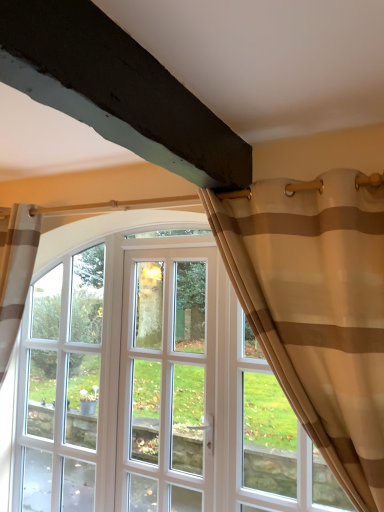
Question: Is the depth of clear glass window at center less than that of beige sheer curtain at upper right?

Choices:
 (A) no
 (B) yes

Answer: (A)

Question: Is clear glass window at center aimed at beige sheer curtain at upper right?

Choices:
 (A) yes
 (B) no

Answer: (B)

Question: From the image's perspective, is clear glass window at center on top of beige sheer curtain at upper right?

Choices:
 (A) no
 (B) yes

Answer: (A)

Question: Considering the relative sizes of clear glass window at center and beige sheer curtain at upper right in the image provided, is clear glass window at center wider than beige sheer curtain at upper right?

Choices:
 (A) no
 (B) yes

Answer: (A)

Question: Are clear glass window at center and beige sheer curtain at upper right making contact?

Choices:
 (A) no
 (B) yes

Answer: (A)

Question: Does clear glass window at center have a greater height compared to beige sheer curtain at upper right?

Choices:
 (A) no
 (B) yes

Answer: (B)

Question: Can you confirm if beige sheer curtain at upper right is thinner than white glass door at center?

Choices:
 (A) no
 (B) yes

Answer: (A)

Question: Considering the relative positions of beige sheer curtain at upper right and white glass door at center in the image provided, is beige sheer curtain at upper right to the right of white glass door at center from the viewer's perspective?

Choices:
 (A) yes
 (B) no

Answer: (A)

Question: Does beige sheer curtain at upper right have a larger size compared to white glass door at center?

Choices:
 (A) no
 (B) yes

Answer: (B)

Question: Considering the relative sizes of beige sheer curtain at upper right and white glass door at center in the image provided, is beige sheer curtain at upper right shorter than white glass door at center?

Choices:
 (A) yes
 (B) no

Answer: (A)

Question: Is beige sheer curtain at upper right outside white glass door at center?

Choices:
 (A) no
 (B) yes

Answer: (B)

Question: Does beige sheer curtain at upper right contain white glass door at center?

Choices:
 (A) no
 (B) yes

Answer: (A)

Question: Can you confirm if beige sheer curtain at upper right is thinner than clear glass window at center?

Choices:
 (A) no
 (B) yes

Answer: (A)